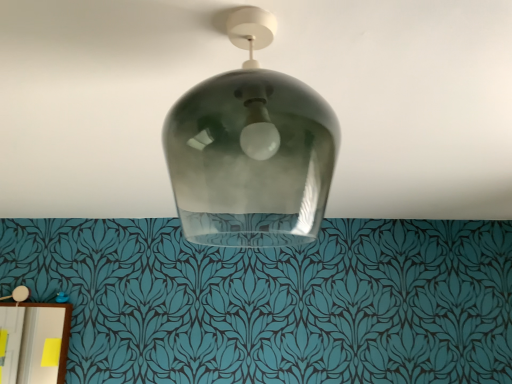
Question: Considering the relative sizes of smoke glass lampshade at center, acting as the first lamp starting from the top, and matte white lampshade at lower left, marked as the second lamp in a top-to-bottom arrangement, in the image provided, is smoke glass lampshade at center, acting as the first lamp starting from the top, thinner than matte white lampshade at lower left, marked as the second lamp in a top-to-bottom arrangement,?

Choices:
 (A) no
 (B) yes

Answer: (A)

Question: From a real-world perspective, is smoke glass lampshade at center, marked as the second lamp in a left-to-right arrangement, on top of matte white lampshade at lower left, which is counted as the 2th lamp, starting from the right?

Choices:
 (A) yes
 (B) no

Answer: (A)

Question: Is smoke glass lampshade at center, acting as the first lamp starting from the top, bigger than matte white lampshade at lower left, the first lamp in the bottom-to-top sequence?

Choices:
 (A) no
 (B) yes

Answer: (B)

Question: Does smoke glass lampshade at center, which ranks as the 2th lamp in back-to-front order, appear on the right side of matte white lampshade at lower left, which is counted as the 2th lamp, starting from the front?

Choices:
 (A) no
 (B) yes

Answer: (B)

Question: Are smoke glass lampshade at center, placed as the 1th lamp when sorted from right to left, and matte white lampshade at lower left, the 1th lamp in the left-to-right sequence, far apart?

Choices:
 (A) no
 (B) yes

Answer: (B)

Question: Does smoke glass lampshade at center, marked as the second lamp in a left-to-right arrangement, have a lesser height compared to matte white lampshade at lower left, the 1th lamp in the left-to-right sequence?

Choices:
 (A) yes
 (B) no

Answer: (B)

Question: From a real-world perspective, does matte white lampshade at lower left, which is counted as the 2th lamp, starting from the right, stand above transparent glass light fixture at center?

Choices:
 (A) no
 (B) yes

Answer: (A)

Question: Is matte white lampshade at lower left, marked as the second lamp in a top-to-bottom arrangement, placed right next to transparent glass light fixture at center?

Choices:
 (A) no
 (B) yes

Answer: (A)

Question: Does matte white lampshade at lower left, which is counted as the 2th lamp, starting from the front, appear on the left side of transparent glass light fixture at center?

Choices:
 (A) no
 (B) yes

Answer: (B)

Question: Is transparent glass light fixture at center surrounded by matte white lampshade at lower left, which is counted as the 2th lamp, starting from the front?

Choices:
 (A) no
 (B) yes

Answer: (A)

Question: Considering the relative sizes of matte white lampshade at lower left, marked as the second lamp in a top-to-bottom arrangement, and transparent glass light fixture at center in the image provided, is matte white lampshade at lower left, marked as the second lamp in a top-to-bottom arrangement, thinner than transparent glass light fixture at center?

Choices:
 (A) yes
 (B) no

Answer: (A)

Question: Is matte white lampshade at lower left, the 1th lamp in the left-to-right sequence, wider than transparent glass light fixture at center?

Choices:
 (A) no
 (B) yes

Answer: (A)

Question: Is the depth of matte white lampshade at lower left, the 1th lamp in the left-to-right sequence, greater than that of smoke glass lampshade at center, which is counted as the second lamp, starting from the bottom?

Choices:
 (A) no
 (B) yes

Answer: (B)